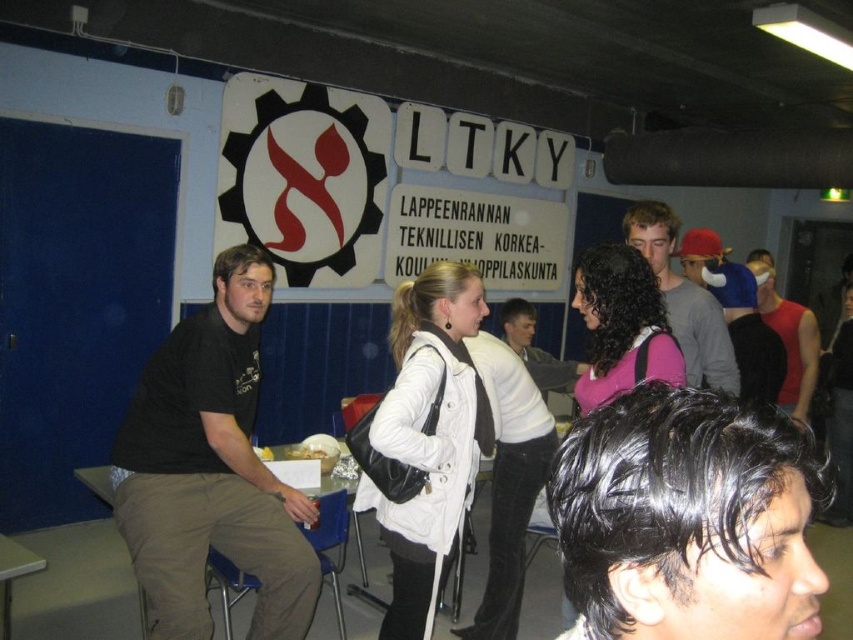
In the scene shown: You are organizing a photo shoot and need to place both the white matte jacket at center and the yellow matte food at center on a table. The table is just wide enough to fit the wider of the two items. Which item should you position first to ensure they both fit?

The white matte jacket at center is wider than the yellow matte food at center, so you should position the white matte jacket at center first to ensure both items fit on the table.

You are at the event and want to find the white matte jacket at center. According to the coordinates provided, where would you look to find it?

The white matte jacket at center is located at point (x=424, y=438), which corresponds to the central area of the image.